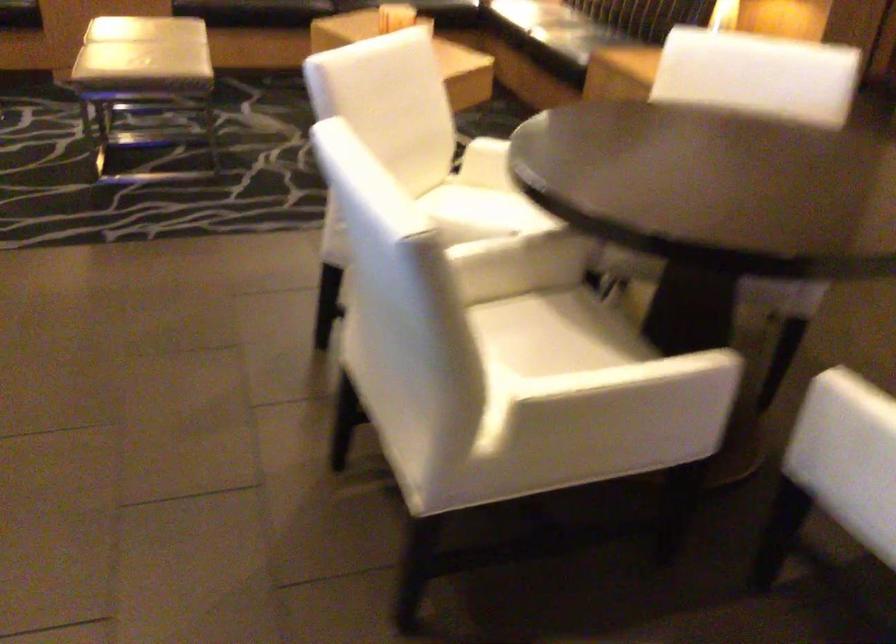
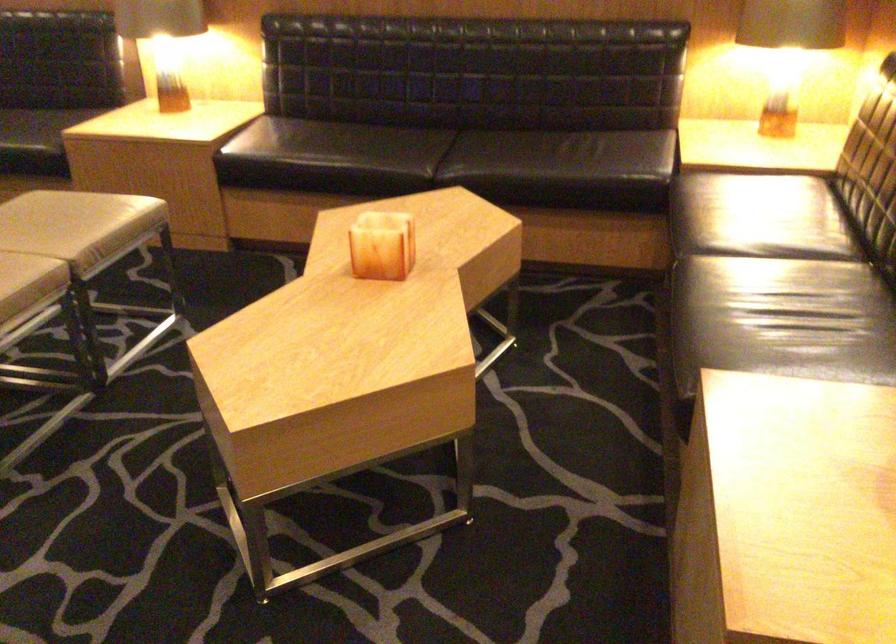
In the second image, find the point that corresponds to the point at 264,69 in the first image.

(283, 263)